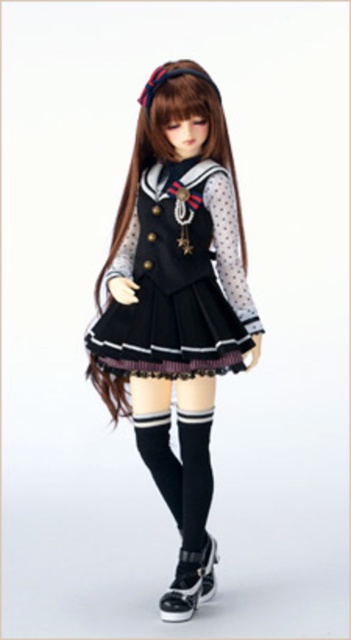
You are taking a photo of the figure and want to focus on both the point at point (163, 152) and the point at point (216, 556). Which point is closer to your camera?

Point (163, 152) is closer to the camera than point (216, 556).

You are a costume designer preparing for a photoshoot. You need to ensure that the black satin dress at center and the black knit socks at lower center are visible in the final image. Based on their current positions, will the socks be visible underneath the dress?

The black satin dress at center is positioned over the black knit socks at lower center, so the socks may not be fully visible as they are covered by the dress.

Based on the scene description, where is the matte black dress at center located in 2D coordinates?

The matte black dress at center is located at point (175, 305) in 2D coordinates.